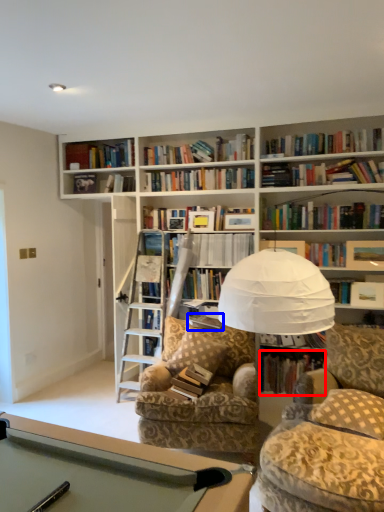
Question: Which point is further to the camera, book (highlighted by a red box) or paperback book (highlighted by a blue box)?

Choices:
 (A) book
 (B) paperback book

Answer: (A)